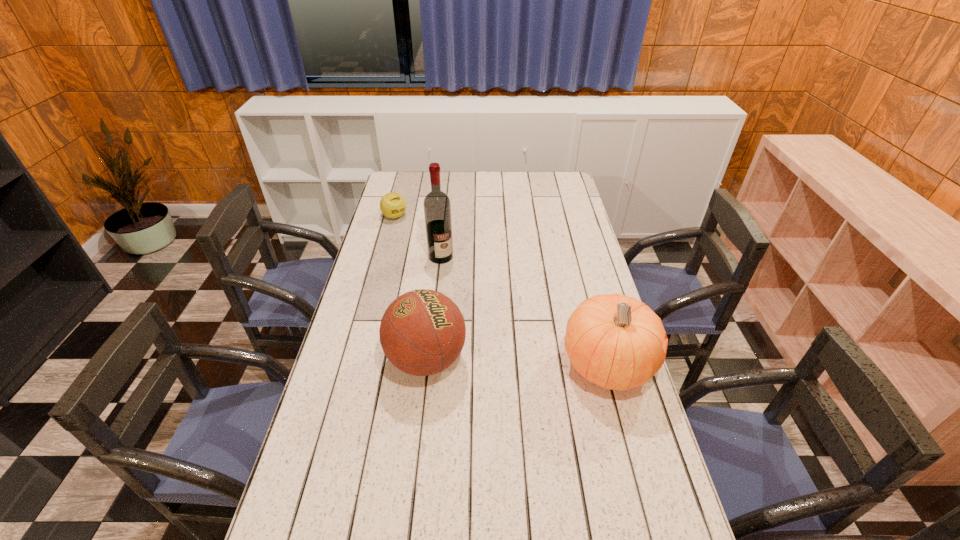
At what (x,y) coordinates should I click in order to perform the action: click on empty space between the rightmost object and the alcohol. Please return your answer as a coordinate pair (x, y). Looking at the image, I should click on (524, 311).

Locate an element on the screen. free space that is in between the softball and the pumpkin is located at coordinates (501, 291).

At what (x,y) coordinates should I click in order to perform the action: click on free space between the alcohol and the farthest object. Please return your answer as a coordinate pair (x, y). The width and height of the screenshot is (960, 540). Looking at the image, I should click on (418, 237).

I want to click on vacant point located between the leftmost object and the tallest object, so click(418, 237).

This screenshot has height=540, width=960. In order to click on empty space between the shortest object and the tallest object in this screenshot , I will do (418, 237).

The width and height of the screenshot is (960, 540). I want to click on vacant space that's between the leftmost object and the alcohol, so click(418, 237).

Identify the location of free space between the basketball and the pumpkin. (516, 362).

Locate an element on the screen. Image resolution: width=960 pixels, height=540 pixels. vacant area that lies between the basketball and the softball is located at coordinates (411, 288).

The width and height of the screenshot is (960, 540). I want to click on free space between the softball and the basketball, so click(x=411, y=288).

Point out which object is positioned as the second nearest to the pumpkin. Please provide its 2D coordinates. Your answer should be formatted as a tuple, i.e. [(x, y)], where the tuple contains the x and y coordinates of a point satisfying the conditions above.

[(437, 207)]